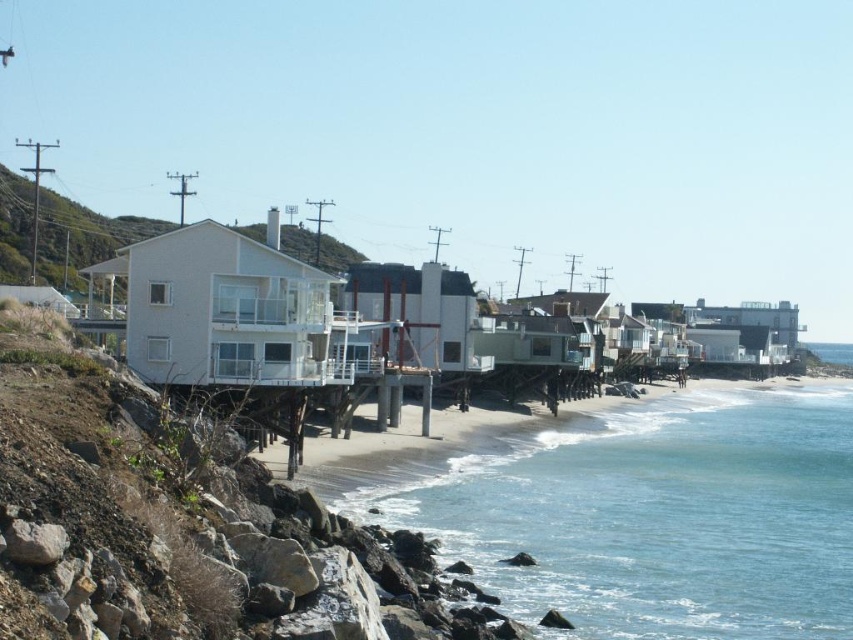
Consider the image. Which of these two, clear blue water at lower right or white matte house at center, stands taller?

white matte house at center is taller.

Can you confirm if clear blue water at lower right is positioned below white matte house at center?

Indeed, clear blue water at lower right is positioned under white matte house at center.

In the scene shown: Measure the distance between clear blue water at lower right and camera.

29.80 meters

Identify the location of clear blue water at lower right. Image resolution: width=853 pixels, height=640 pixels. (654, 516).